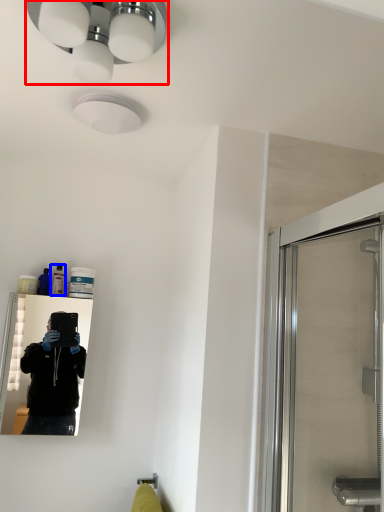
Question: Which point is closer to the camera, light fixture (highlighted by a red box) or toiletry (highlighted by a blue box)?

Choices:
 (A) light fixture
 (B) toiletry

Answer: (A)